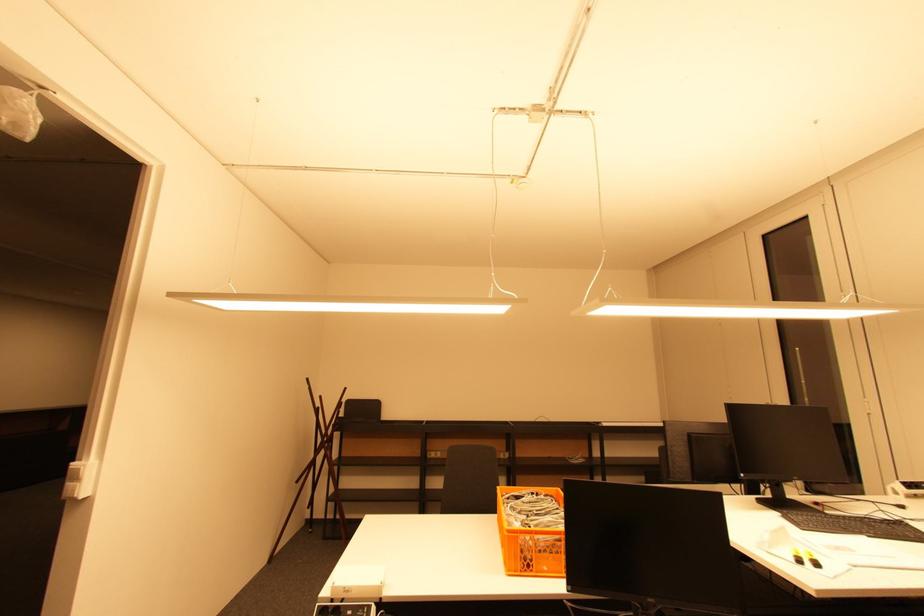
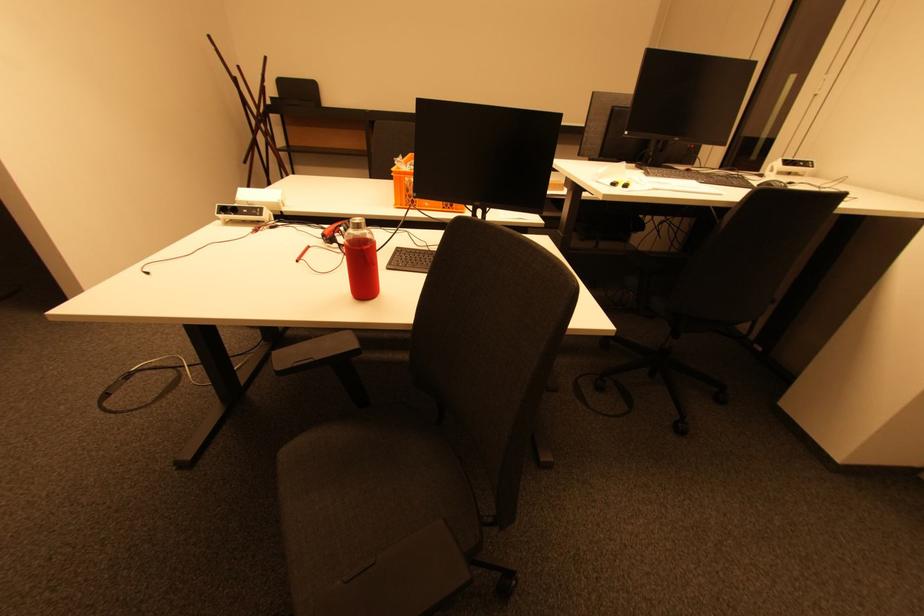
Question: The first image is from the beginning of the video and the second image is from the end. How did the camera likely rotate when shooting the video?

Choices:
 (A) Left
 (B) Right
 (C) Up
 (D) Down

Answer: (D)